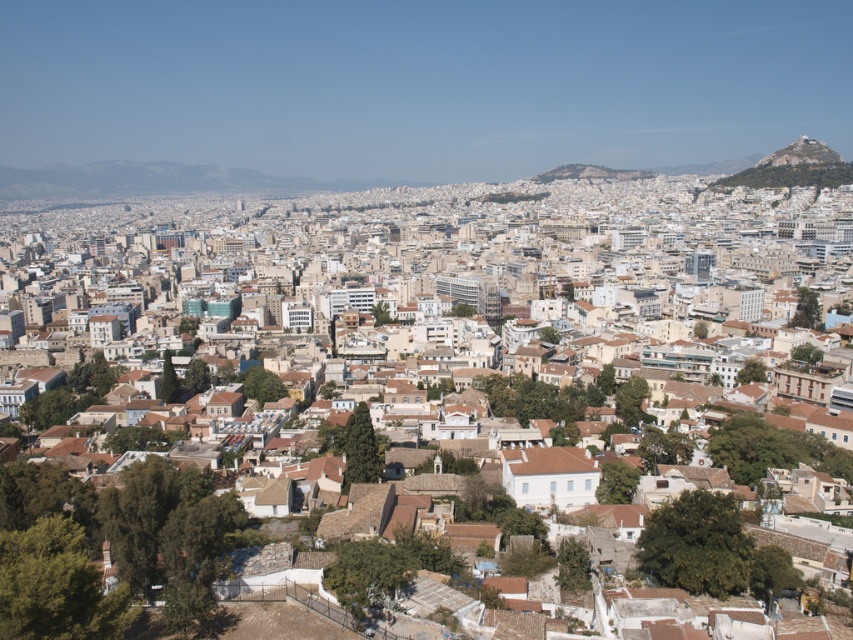
Question: Where is white textured buildings at center located in relation to rustic stone peak at upper right in the image?

Choices:
 (A) right
 (B) left

Answer: (B)

Question: Which object is farther from the camera taking this photo?

Choices:
 (A) rustic stone peak at upper right
 (B) white textured buildings at center

Answer: (A)

Question: Does white textured buildings at center appear over rustic stone peak at upper right?

Choices:
 (A) no
 (B) yes

Answer: (A)

Question: Can you confirm if white textured buildings at center is wider than rustic stone peak at upper right?

Choices:
 (A) yes
 (B) no

Answer: (A)

Question: Which of the following is the closest to the observer?

Choices:
 (A) white textured buildings at center
 (B) rustic stone peak at upper right

Answer: (A)